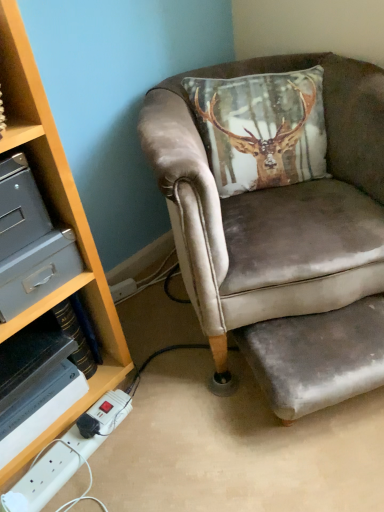
Where is `free space that is in between white plastic power strip at lower left and velvet grey footrest at lower right`? The width and height of the screenshot is (384, 512). free space that is in between white plastic power strip at lower left and velvet grey footrest at lower right is located at coordinates (183, 432).